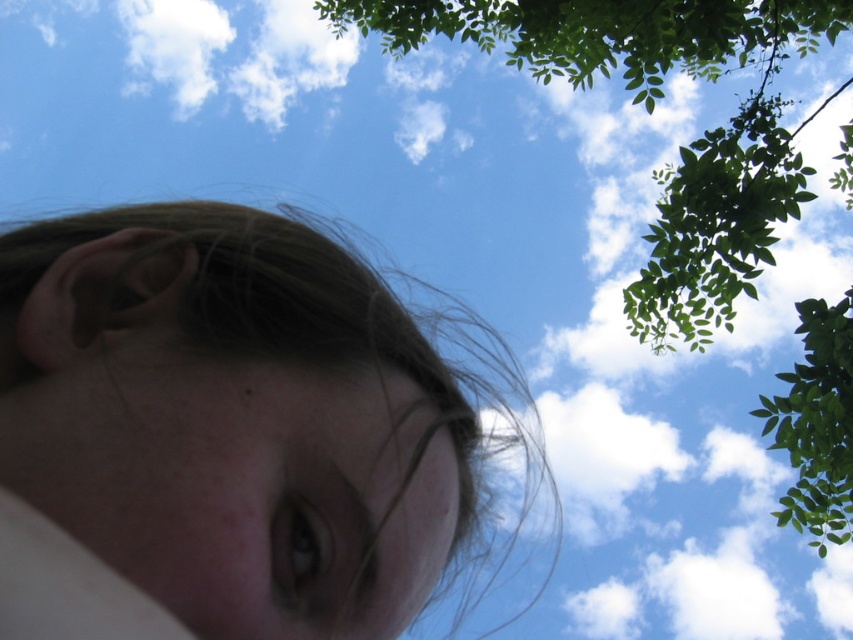
Does smooth skin eye at center have a greater width compared to green leafy tree at upper right?

No, smooth skin eye at center is not wider than green leafy tree at upper right.

Consider the image. Who is taller, smooth skin eye at center or green leafy tree at upper right?

Standing taller between the two is green leafy tree at upper right.

What do you see at coordinates (248, 486) in the screenshot?
I see `smooth skin eye at center` at bounding box center [248, 486].

This screenshot has height=640, width=853. I want to click on smooth skin eye at center, so click(248, 486).

Which is in front, point (106, 378) or point (96, 417)?

Point (96, 417)

Based on the photo, can you confirm if smooth skin face at center is thinner than smooth skin eye at center?

No.

Find the location of `smooth skin face at center`. smooth skin face at center is located at coordinates (247, 412).

Which is more to the right, smooth skin face at center or green leafy tree at upper right?

green leafy tree at upper right is more to the right.

What do you see at coordinates (247, 412) in the screenshot? The width and height of the screenshot is (853, 640). I see `smooth skin face at center` at bounding box center [247, 412].

Find the location of a particular element. The image size is (853, 640). smooth skin face at center is located at coordinates (247, 412).